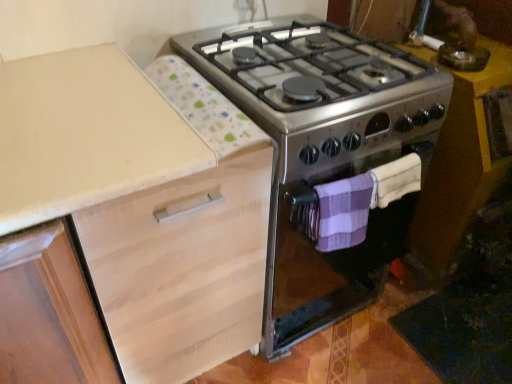
Question: Is metallic yellow table at right shorter than purple knitted towel at lower right, which is counted as the 2th blanket, starting from the left?

Choices:
 (A) no
 (B) yes

Answer: (A)

Question: Would you say metallic yellow table at right contains purple knitted towel at lower right, which is counted as the 2th blanket, starting from the left?

Choices:
 (A) yes
 (B) no

Answer: (B)

Question: Considering the relative sizes of metallic yellow table at right and purple knitted towel at lower right, acting as the first blanket starting from the right, in the image provided, is metallic yellow table at right bigger than purple knitted towel at lower right, acting as the first blanket starting from the right,?

Choices:
 (A) no
 (B) yes

Answer: (B)

Question: Is metallic yellow table at right not within purple knitted towel at lower right, acting as the first blanket starting from the right?

Choices:
 (A) no
 (B) yes

Answer: (B)

Question: Can you confirm if metallic yellow table at right is thinner than purple knitted towel at lower right, acting as the first blanket starting from the right?

Choices:
 (A) no
 (B) yes

Answer: (A)

Question: From the image's perspective, is purple knitted towel at lower right, acting as the first blanket starting from the right, above or below purple striped towel at lower right, arranged as the second blanket when viewed from the right?

Choices:
 (A) above
 (B) below

Answer: (A)

Question: Visually, is purple knitted towel at lower right, acting as the first blanket starting from the right, positioned to the left or to the right of purple striped towel at lower right, arranged as the second blanket when viewed from the right?

Choices:
 (A) right
 (B) left

Answer: (A)

Question: From a real-world perspective, relative to purple striped towel at lower right, placed as the 1th blanket when sorted from left to right, is purple knitted towel at lower right, which is counted as the 2th blanket, starting from the left, vertically above or below?

Choices:
 (A) below
 (B) above

Answer: (B)

Question: Is purple knitted towel at lower right, acting as the first blanket starting from the right, in front of or behind purple striped towel at lower right, placed as the 1th blanket when sorted from left to right, in the image?

Choices:
 (A) front
 (B) behind

Answer: (B)

Question: Considering their positions, is light wood cabinet at upper left located in front of or behind purple striped towel at lower right, placed as the 1th blanket when sorted from left to right?

Choices:
 (A) behind
 (B) front

Answer: (B)

Question: Looking at their shapes, would you say light wood cabinet at upper left is wider or thinner than purple striped towel at lower right, arranged as the second blanket when viewed from the right?

Choices:
 (A) thin
 (B) wide

Answer: (B)

Question: In terms of size, does light wood cabinet at upper left appear bigger or smaller than purple striped towel at lower right, arranged as the second blanket when viewed from the right?

Choices:
 (A) small
 (B) big

Answer: (B)

Question: From the image's perspective, is light wood cabinet at upper left located above or below purple striped towel at lower right, arranged as the second blanket when viewed from the right?

Choices:
 (A) below
 (B) above

Answer: (A)

Question: Looking at their shapes, would you say metallic yellow table at right is wider or thinner than stainless steel stove at center?

Choices:
 (A) wide
 (B) thin

Answer: (B)

Question: In the image, is metallic yellow table at right positioned in front of or behind stainless steel stove at center?

Choices:
 (A) front
 (B) behind

Answer: (B)